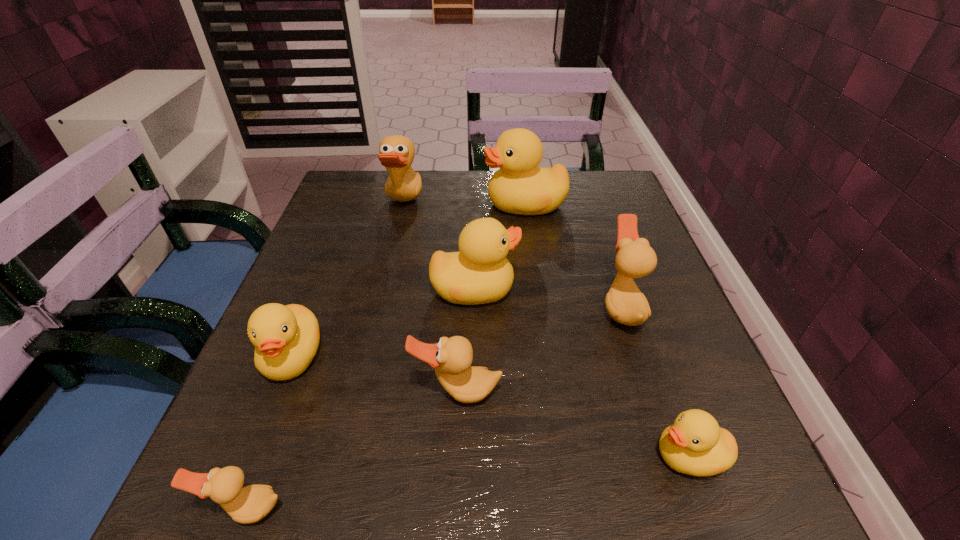
Locate an element on the screen. The image size is (960, 540). free space between the second farthest tan duck and the third tan duck from right to left is located at coordinates (513, 256).

This screenshot has height=540, width=960. In order to click on free space between the leftmost tan duck and the second tan duck from left to right in this screenshot , I will do `click(324, 356)`.

Image resolution: width=960 pixels, height=540 pixels. What are the coordinates of `free spot between the nearest tan duck and the third duck from left to right` in the screenshot? It's located at (324, 356).

At what (x,y) coordinates should I click in order to perform the action: click on free space between the biggest tan duck and the leftmost yellow duck. Please return your answer as a coordinate pair (x, y). This screenshot has height=540, width=960. Looking at the image, I should click on (348, 281).

Where is `vacant area that lies between the third nearest tan duck and the second nearest yellow duck`? vacant area that lies between the third nearest tan duck and the second nearest yellow duck is located at coordinates (457, 332).

Identify the location of object that is the sixth closest to the second biggest tan duck. (286, 338).

Locate which object ranks in proximity to the biggest tan duck. Please provide its 2D coordinates. Your answer should be formatted as a tuple, i.e. [(x, y)], where the tuple contains the x and y coordinates of a point satisfying the conditions above.

[(520, 187)]

Identify which duck is the fifth nearest to the second smallest tan duck. Please provide its 2D coordinates. Your answer should be formatted as a tuple, i.e. [(x, y)], where the tuple contains the x and y coordinates of a point satisfying the conditions above.

[(695, 445)]

Where is `the second closest duck to the nearest duck`? Image resolution: width=960 pixels, height=540 pixels. the second closest duck to the nearest duck is located at coordinates (451, 358).

Locate an element on the screen. Image resolution: width=960 pixels, height=540 pixels. the fourth closest yellow duck to the third biggest tan duck is located at coordinates (520, 187).